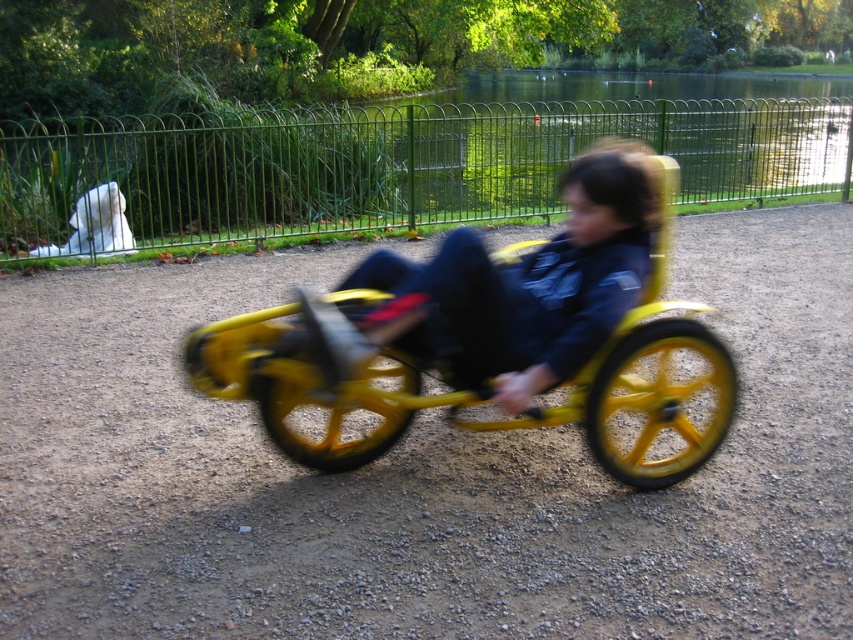
Which is below, yellow matte tricycle at center or green metallic fence at upper center?

yellow matte tricycle at center is lower down.

Can you confirm if yellow matte tricycle at center is wider than green metallic fence at upper center?

Incorrect, yellow matte tricycle at center's width does not surpass green metallic fence at upper center's.

Describe the element at coordinates (511, 289) in the screenshot. The width and height of the screenshot is (853, 640). I see `yellow matte tricycle at center` at that location.

Find the location of a particular element. yellow matte tricycle at center is located at coordinates (511, 289).

Consider the image. Which of these two, green metallic fence at upper center or white fur ghost at upper left, stands taller?

With more height is green metallic fence at upper center.

Which is more to the right, green metallic fence at upper center or white fur ghost at upper left?

From the viewer's perspective, green metallic fence at upper center appears more on the right side.

In order to click on green metallic fence at upper center in this screenshot , I will do `click(631, 84)`.

Can you confirm if yellow matte tricycle at center is positioned above white fur ghost at upper left?

→ Actually, yellow matte tricycle at center is below white fur ghost at upper left.

The width and height of the screenshot is (853, 640). In order to click on yellow matte tricycle at center in this screenshot , I will do `click(511, 289)`.